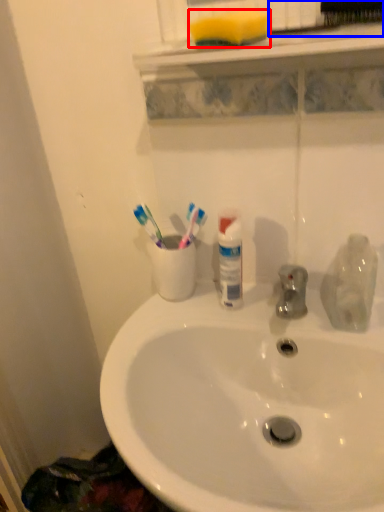
Question: Among these objects, which one is nearest to the camera, soap (highlighted by a red box) or brush (highlighted by a blue box)?

Choices:
 (A) soap
 (B) brush

Answer: (B)